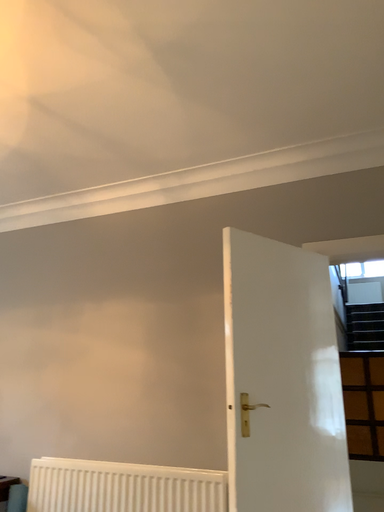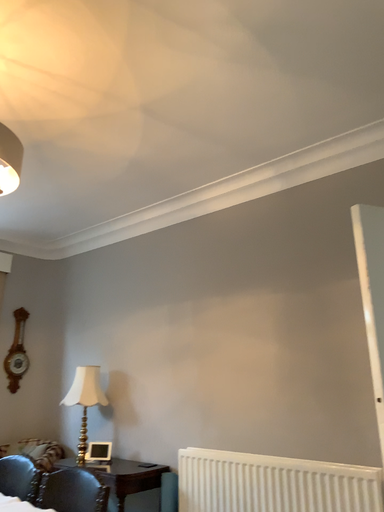
Question: Which way did the camera rotate in the video?

Choices:
 (A) rotated left
 (B) rotated right

Answer: (A)